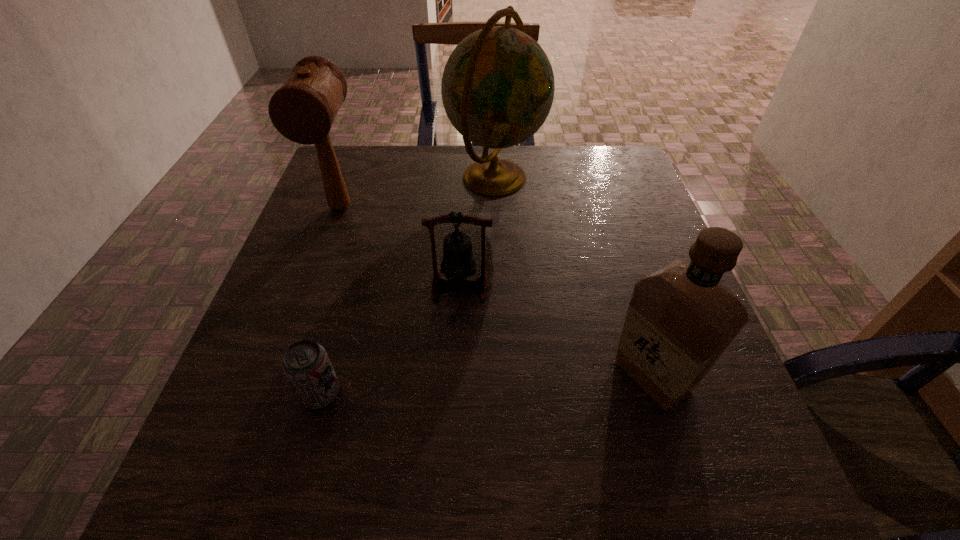
This screenshot has height=540, width=960. I want to click on free spot between the rightmost object and the mallet, so click(496, 292).

Image resolution: width=960 pixels, height=540 pixels. I want to click on vacant area between the liquor and the beer can, so click(487, 385).

Locate an element on the screen. vacant region between the beer can and the liquor is located at coordinates (487, 385).

Locate an element on the screen. The image size is (960, 540). vacant space in between the shortest object and the mallet is located at coordinates (331, 301).

You are a GUI agent. You are given a task and a screenshot of the screen. Output one action in this format:
    pyautogui.click(x=<x>, y=<y>)
    Task: Click on the vacant area that lies between the second shortest object and the mallet
    The image size is (960, 540).
    Given the screenshot: What is the action you would take?
    pyautogui.click(x=400, y=247)

Where is `object that is the third closest to the liquor`? This screenshot has width=960, height=540. object that is the third closest to the liquor is located at coordinates (306, 364).

Where is `the fourth closest object relative to the tallest object`? the fourth closest object relative to the tallest object is located at coordinates (306, 364).

At what (x,y) coordinates should I click in order to perform the action: click on vacant space that satisfies the following two spatial constraints: 1. on the back side of the bell; 2. on the right side of the globe. Please return your answer as a coordinate pair (x, y). The height and width of the screenshot is (540, 960). Looking at the image, I should click on (465, 177).

Where is `vacant area in the image that satisfies the following two spatial constraints: 1. on the strike surface of the third nearest object; 2. on the left side of the mallet`? This screenshot has height=540, width=960. vacant area in the image that satisfies the following two spatial constraints: 1. on the strike surface of the third nearest object; 2. on the left side of the mallet is located at coordinates click(312, 286).

Locate an element on the screen. vacant space that satisfies the following two spatial constraints: 1. on the back side of the globe; 2. on the right side of the shortest object is located at coordinates (381, 177).